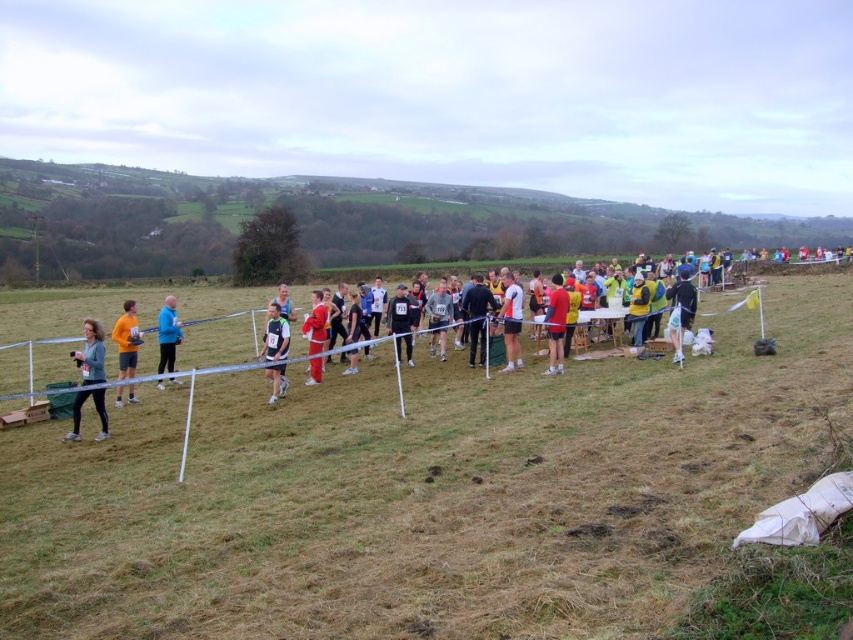
You are a photographer at the event and need to capture a clear photo of the white matte shirt at center without the red smooth pants at center showing. Is this possible given their positions?

The white matte shirt at center is positioned over the red smooth pants at center, so it would block the view of the pants, making it possible to capture a clear photo of the shirt without the pants showing.

You are a photographer at the event and want to capture a photo that includes both the multicolored running group at center and the orange fleece jacket at left. Based on their positions, which object should you focus on first to ensure both are in frame?

The multicolored running group at center might be wider than orange fleece jacket at left, so you should focus on the multicolored running group at center first to ensure both are in frame.